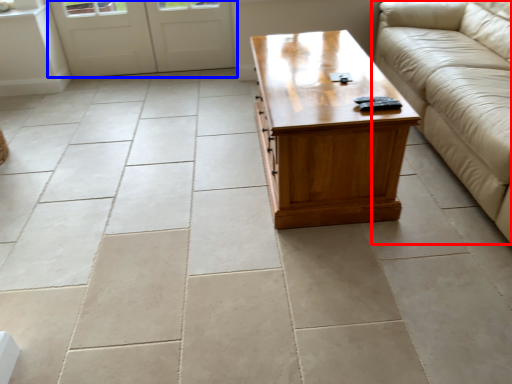
Question: Which object appears closest to the camera in this image, studio couch (highlighted by a red box) or door (highlighted by a blue box)?

Choices:
 (A) studio couch
 (B) door

Answer: (A)